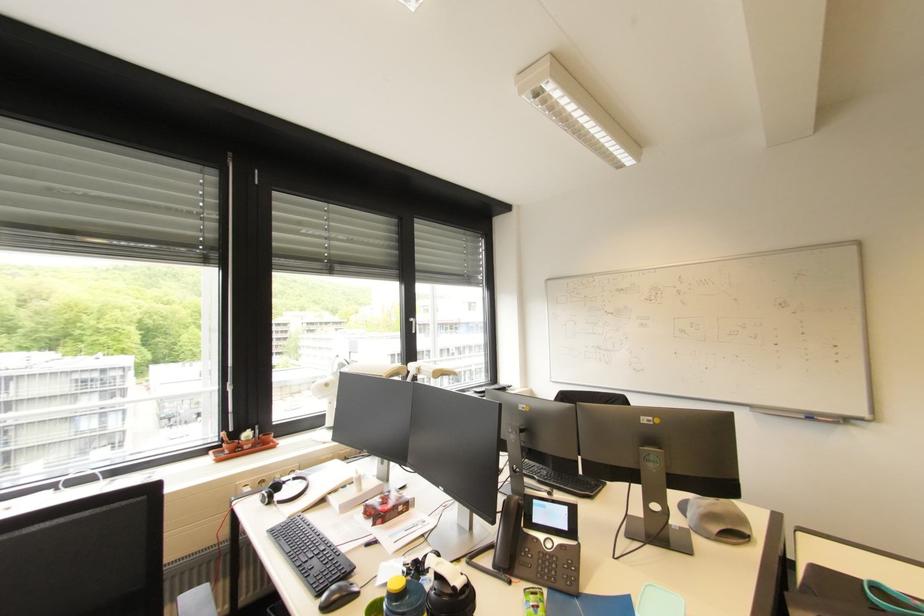
This screenshot has width=924, height=616. Describe the element at coordinates (337, 596) in the screenshot. I see `the black computer mouse` at that location.